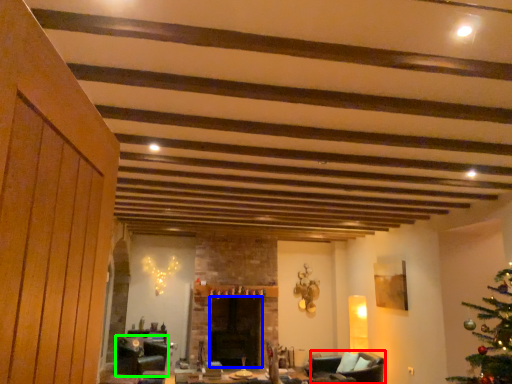
Question: Based on their relative distances, which object is nearer to armchair (highlighted by a red box)? Choose from fireplace (highlighted by a blue box) and swivel chair (highlighted by a green box).

Choices:
 (A) fireplace
 (B) swivel chair

Answer: (A)